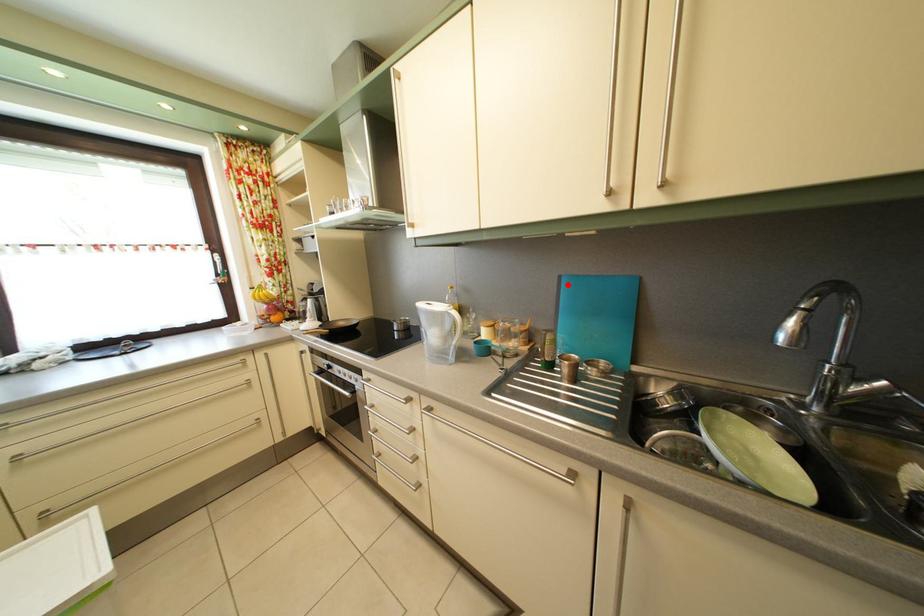
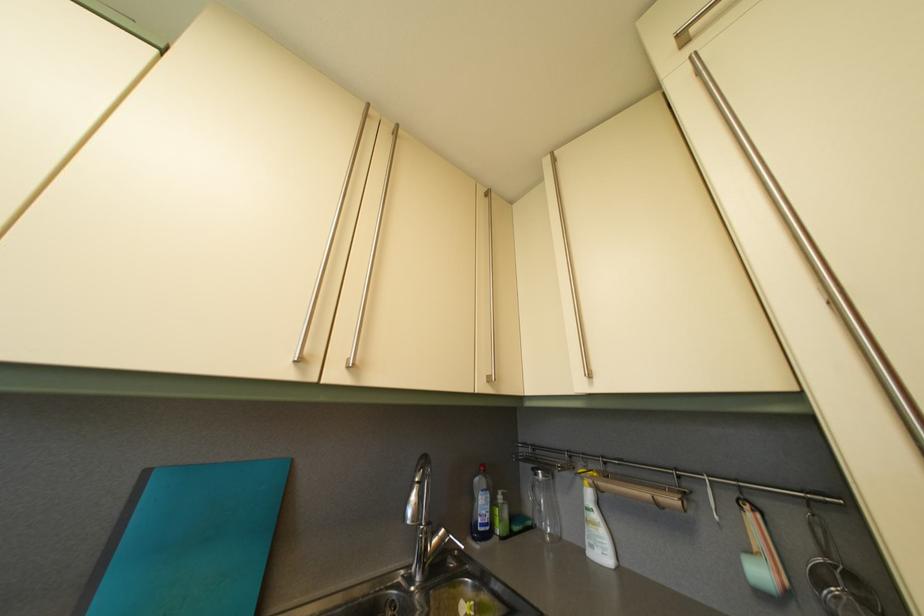
In the second image, find the point that corresponds to the highlighted location in the first image.

(154, 480)